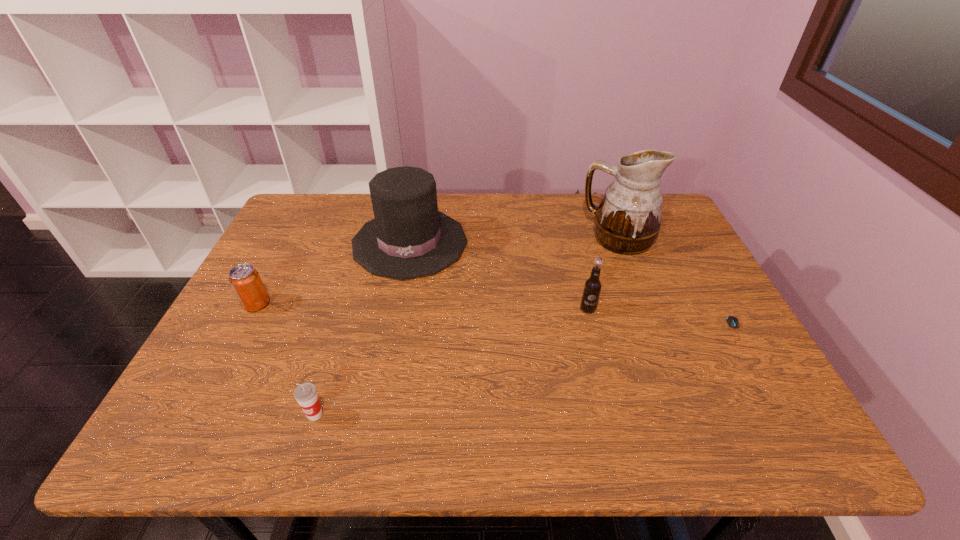
The image size is (960, 540). In order to click on empty space that is in between the fifth shortest object and the cup in this screenshot , I will do `click(363, 329)`.

This screenshot has height=540, width=960. I want to click on free space that is in between the cup and the soda can, so click(x=286, y=359).

At what (x,y) coordinates should I click in order to perform the action: click on free space between the fourth object from left to right and the soda can. Please return your answer as a coordinate pair (x, y). The height and width of the screenshot is (540, 960). Looking at the image, I should click on (422, 307).

Identify the location of free space between the fifth shortest object and the nearest object. The height and width of the screenshot is (540, 960). (363, 329).

Find the location of `free area in between the second tallest object and the second object from right to left`. free area in between the second tallest object and the second object from right to left is located at coordinates (514, 240).

This screenshot has width=960, height=540. Identify the location of free point between the mouse and the leftmost object. (495, 318).

The width and height of the screenshot is (960, 540). Find the location of `unoccupied position between the third object from right to left and the dress hat`. unoccupied position between the third object from right to left and the dress hat is located at coordinates (498, 276).

Find the location of a particular element. free space between the pitcher and the second tallest object is located at coordinates (514, 240).

The height and width of the screenshot is (540, 960). Identify the location of blank region between the fourth shortest object and the fifth shortest object. [x=498, y=276].

Locate which object is the fifth closest to the shortest object. Please provide its 2D coordinates. Your answer should be formatted as a tuple, i.e. [(x, y)], where the tuple contains the x and y coordinates of a point satisfying the conditions above.

[(244, 279)]